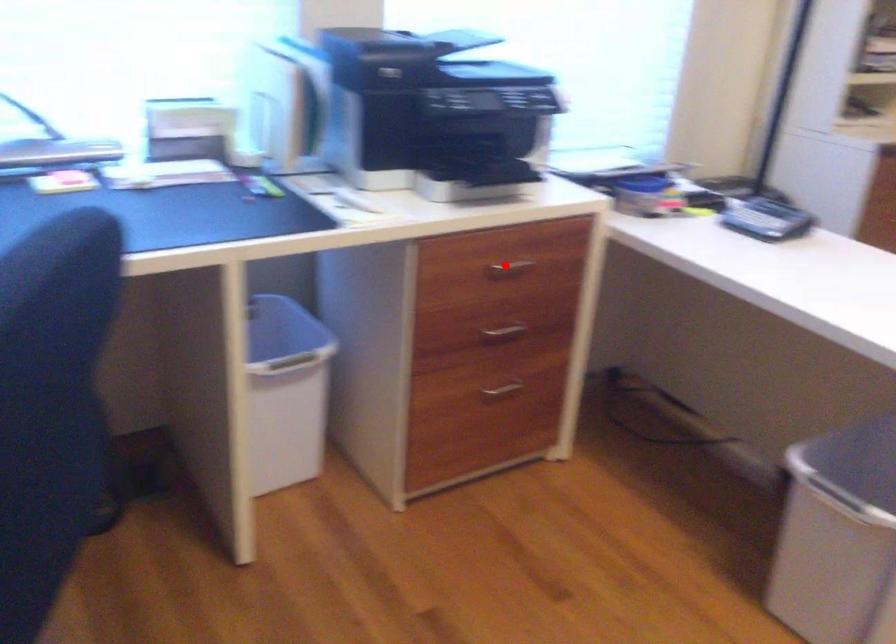
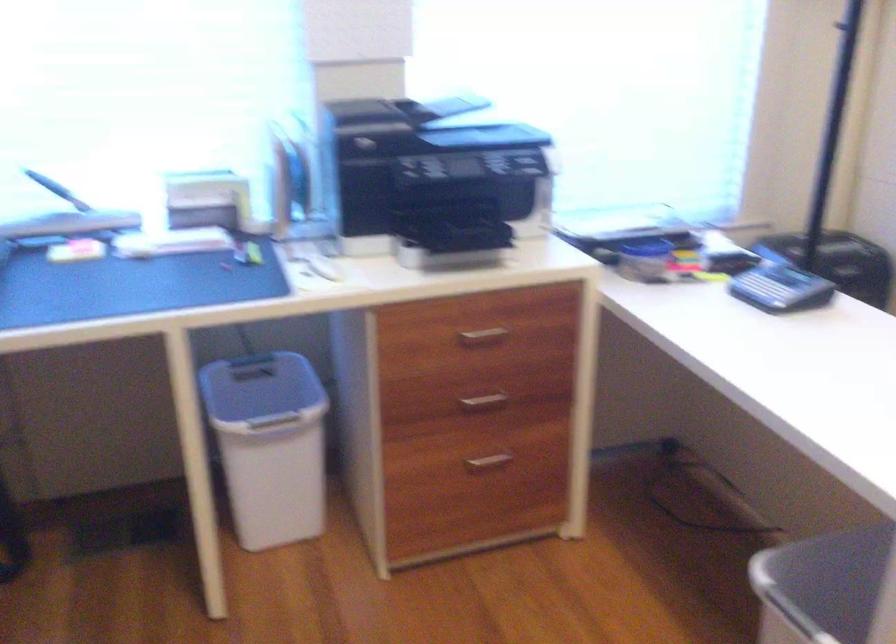
The point at the highlighted location is marked in the first image. Where is the corresponding point in the second image?

(483, 334)